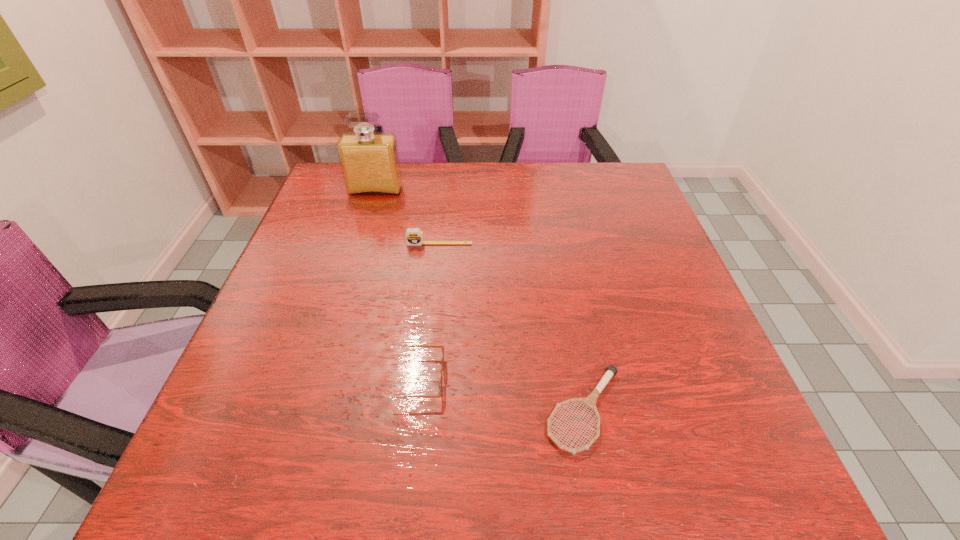
The image size is (960, 540). Find the location of `the farthest object`. the farthest object is located at coordinates (370, 165).

Image resolution: width=960 pixels, height=540 pixels. Find the location of `perfume`. perfume is located at coordinates (370, 165).

The width and height of the screenshot is (960, 540). Find the location of `tape measure`. tape measure is located at coordinates (414, 236).

The height and width of the screenshot is (540, 960). What are the coordinates of `sunglasses` in the screenshot? It's located at (429, 346).

In order to click on the rightmost object in this screenshot , I will do `click(590, 401)`.

Where is `tennis racket`? The width and height of the screenshot is (960, 540). tennis racket is located at coordinates (590, 401).

Where is `vacant space located 0.210m on the front-facing side of the tallest object`? vacant space located 0.210m on the front-facing side of the tallest object is located at coordinates [359, 244].

Find the location of a particular element. free region located 0.250m at the front of the tape measure with the tape extended is located at coordinates (431, 323).

Find the location of a particular element. This screenshot has height=540, width=960. vacant space located on the front-facing side of the sunglasses is located at coordinates (518, 378).

Where is `free spot located on the left of the shortest object`? The width and height of the screenshot is (960, 540). free spot located on the left of the shortest object is located at coordinates (419, 410).